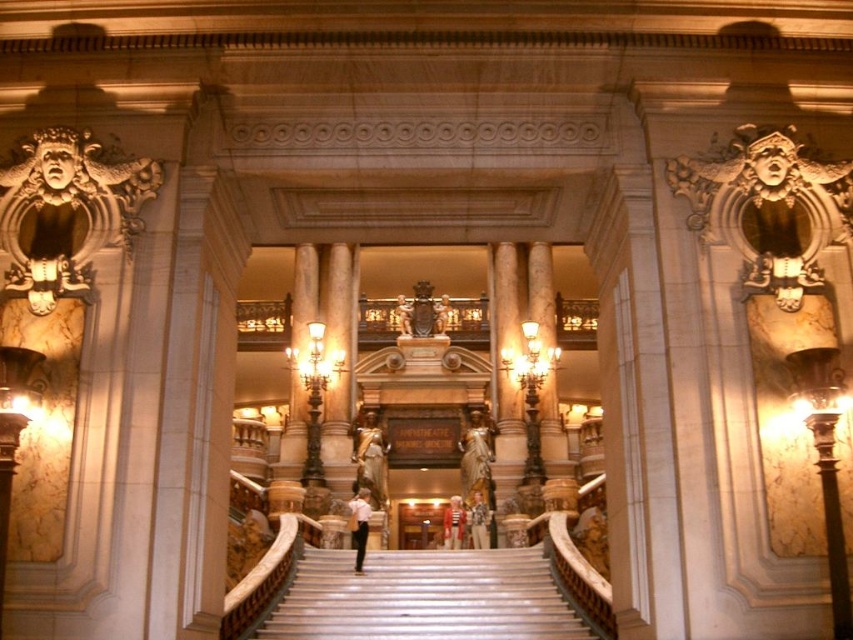
Question: Is white matte shirt at center below light brown leather jacket at center?

Choices:
 (A) no
 (B) yes

Answer: (A)

Question: Which point is farther to the camera?

Choices:
 (A) white cotton shirt at center
 (B) white matte shirt at center

Answer: (A)

Question: Is white marble stairs at center bigger than white matte shirt at center?

Choices:
 (A) yes
 (B) no

Answer: (A)

Question: Can you confirm if white marble stairs at center is smaller than bronze statue at center?

Choices:
 (A) no
 (B) yes

Answer: (B)

Question: Which of the following is the farthest from the observer?

Choices:
 (A) bronze statue at center
 (B) matte gold statue at center
 (C) white matte shirt at center

Answer: (B)

Question: Which point appears farthest from the camera in this image?

Choices:
 (A) (474, 529)
 (B) (434, 316)
 (C) (360, 570)
 (D) (297, 598)

Answer: (B)